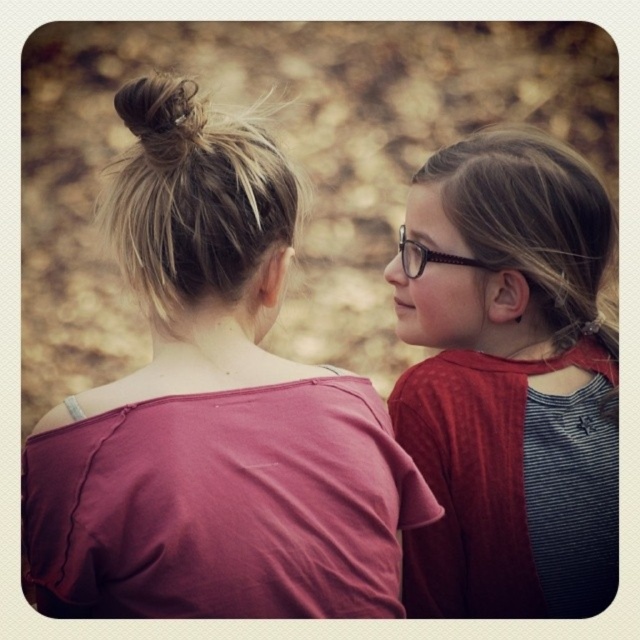
You are a photographer trying to capture a candid shot of the two people in the scene. You want to frame the shot so that the matte brown hair at upper right and the brown hair bun at upper left are both visible. Based on their positions, which hair style should you focus on first to ensure both are in the frame?

The matte brown hair at upper right is below the brown hair bun at upper left, so you should focus on the brown hair bun at upper left first to ensure both are in the frame.

You are a photographer trying to capture a portrait of both the blondehair at upper left and the brown hair bun at upper left. Since you want to ensure both subjects are framed properly, can you determine which of the two has a wider hairstyle?

The blondehair at upper left has a wider hairstyle than the brown hair bun at upper left because the blondehair at upper left is wider than the brown hair bun at upper left.

You are standing in a park and see two people sitting on a bench. You want to approach the person with the brown hair bun at upper left first. Which direction should you walk from the matte brown hair at upper right to reach them?

Since the matte brown hair at upper right is closer to you than the brown hair bun at upper left, you should walk towards the direction of the brown hair bun at upper left, which is behind the matte brown hair at upper right.